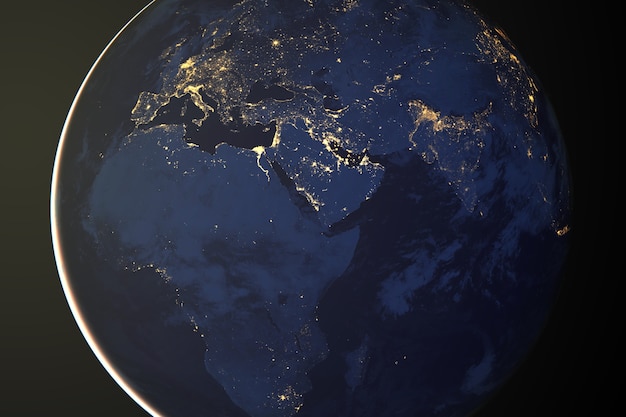
At what (x,y) coordinates should I click in order to perform the action: click on globe. Please return your answer as a coordinate pair (x, y). Looking at the image, I should click on (393, 248).